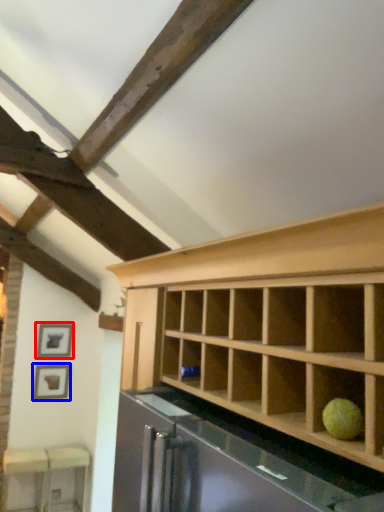
Question: Among these objects, which one is farthest to the camera, picture frame (highlighted by a red box) or picture frame (highlighted by a blue box)?

Choices:
 (A) picture frame
 (B) picture frame

Answer: (A)